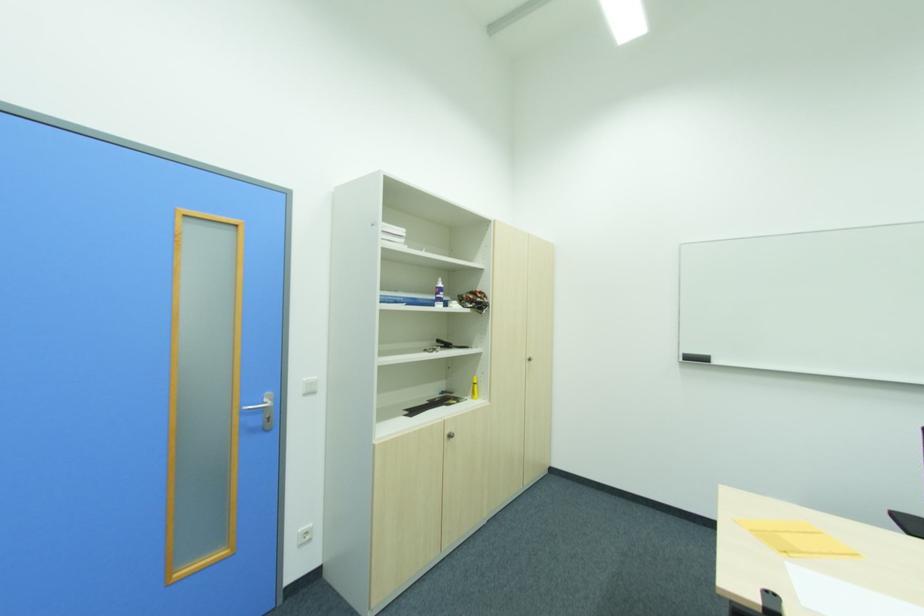
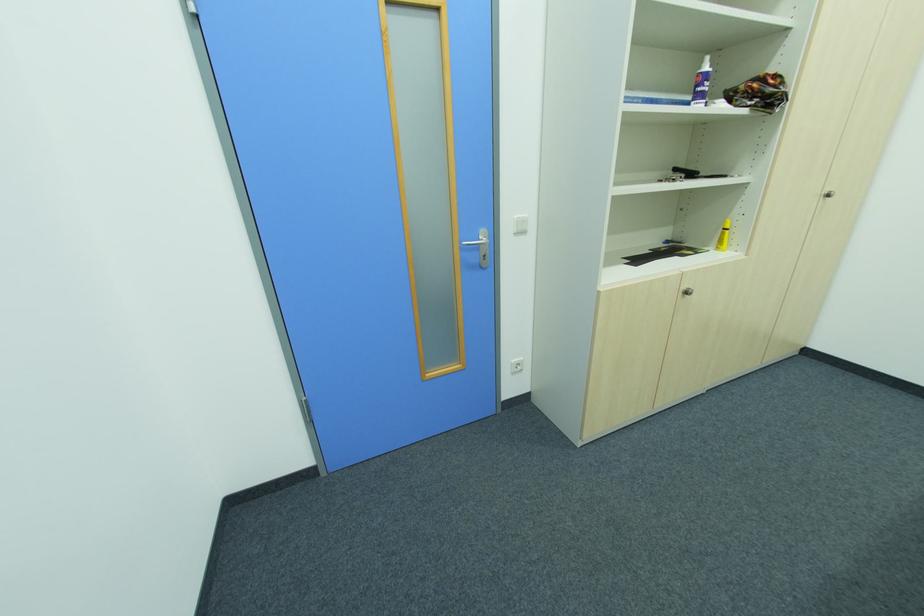
The point at (270, 400) is marked in the first image. Where is the corresponding point in the second image?

(484, 238)